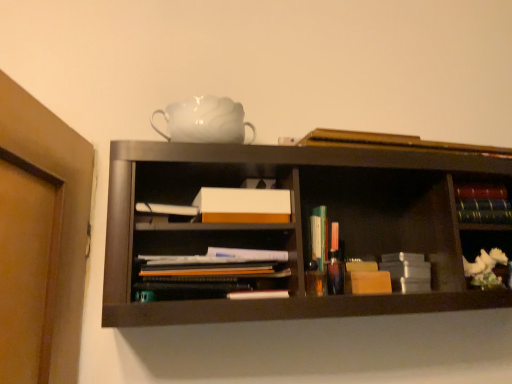
Question: From a real-world perspective, is translucent plastic books at center, the first book in the bottom-to-top sequence, beneath white ceramic flower at right?

Choices:
 (A) no
 (B) yes

Answer: (A)

Question: Can you confirm if translucent plastic books at center, which appears as the 4th book when viewed from the top, is positioned to the right of white ceramic flower at right?

Choices:
 (A) yes
 (B) no

Answer: (B)

Question: From a real-world perspective, is translucent plastic books at center, which appears as the 4th book when viewed from the top, positioned over white ceramic flower at right based on gravity?

Choices:
 (A) no
 (B) yes

Answer: (B)

Question: From the image's perspective, does translucent plastic books at center, which appears as the 4th book when viewed from the top, appear higher than white ceramic flower at right?

Choices:
 (A) yes
 (B) no

Answer: (A)

Question: Considering the relative positions of translucent plastic books at center, which appears as the 4th book when viewed from the top, and white ceramic flower at right in the image provided, is translucent plastic books at center, which appears as the 4th book when viewed from the top, behind white ceramic flower at right?

Choices:
 (A) no
 (B) yes

Answer: (A)

Question: Considering the positions of hardcover book at upper center, the fourth book ordered from the bottom, and multicolored hardcover books at right, the 2th book from the top, in the image, is hardcover book at upper center, the fourth book ordered from the bottom, taller or shorter than multicolored hardcover books at right, the 2th book from the top,?

Choices:
 (A) short
 (B) tall

Answer: (A)

Question: Does point (328, 130) appear closer or farther from the camera than point (458, 200)?

Choices:
 (A) closer
 (B) farther

Answer: (A)

Question: From a real-world perspective, is hardcover book at upper center, the first book from the top, above or below multicolored hardcover books at right, which is the 3th book in bottom-to-top order?

Choices:
 (A) above
 (B) below

Answer: (A)

Question: Looking at their shapes, would you say hardcover book at upper center, the first book from the top, is wider or thinner than multicolored hardcover books at right, the 2th book from the top?

Choices:
 (A) wide
 (B) thin

Answer: (B)

Question: Would you say hardcover books at right, positioned as the 2th book in bottom-to-top order, is to the left or to the right of multicolored hardcover books at right, which is the 3th book in bottom-to-top order, in the picture?

Choices:
 (A) left
 (B) right

Answer: (B)

Question: Does point (498, 213) appear closer or farther from the camera than point (478, 216)?

Choices:
 (A) farther
 (B) closer

Answer: (A)

Question: Is hardcover books at right, positioned as the 2th book in bottom-to-top order, bigger or smaller than multicolored hardcover books at right, which is the 3th book in bottom-to-top order?

Choices:
 (A) small
 (B) big

Answer: (A)

Question: From the image's perspective, relative to multicolored hardcover books at right, which is the 3th book in bottom-to-top order, is hardcover books at right, positioned as the 2th book in bottom-to-top order, above or below?

Choices:
 (A) above
 (B) below

Answer: (B)

Question: In terms of width, does white ceramic flower at right look wider or thinner when compared to hardcover books at right, positioned as the 3th book in top-to-bottom order?

Choices:
 (A) thin
 (B) wide

Answer: (B)

Question: Choose the correct answer: Is white ceramic flower at right inside hardcover books at right, positioned as the 2th book in bottom-to-top order, or outside it?

Choices:
 (A) outside
 (B) inside

Answer: (A)